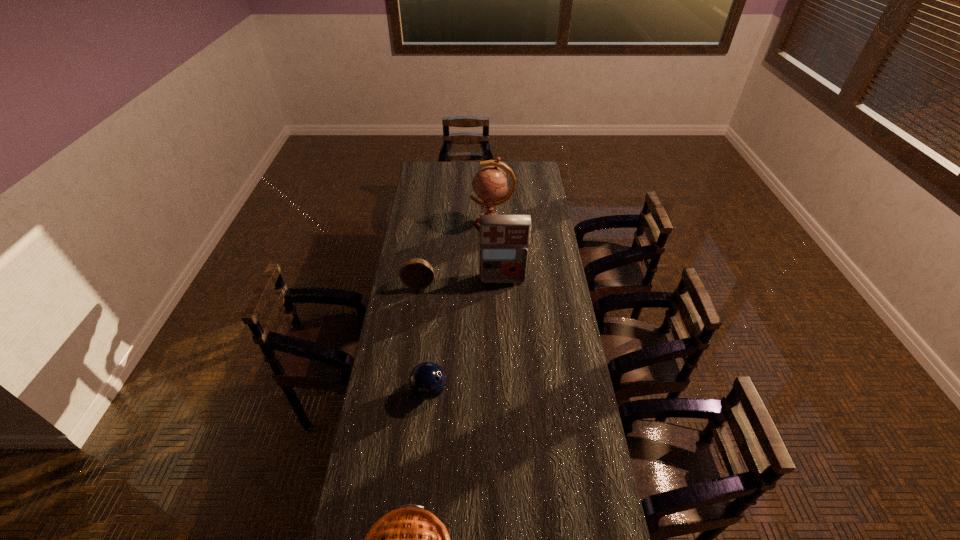
Image resolution: width=960 pixels, height=540 pixels. I want to click on vacant point located 0.190m on the surface of the fourth farthest object near the finger holes, so click(x=499, y=391).

The image size is (960, 540). Identify the location of bowl present at the left edge. (416, 273).

The image size is (960, 540). I want to click on bowling ball positioned at the left edge, so click(x=427, y=380).

In the image, there is a desktop. Where is `vacant space at the left edge`? This screenshot has width=960, height=540. vacant space at the left edge is located at coordinates (422, 225).

Identify the location of vacant region at the right edge of the desktop. This screenshot has width=960, height=540. (542, 224).

Locate an element on the screen. This screenshot has height=540, width=960. vacant area at the far right corner of the desktop is located at coordinates (533, 177).

The height and width of the screenshot is (540, 960). Find the location of `empty space between the bowling ball and the globe`. empty space between the bowling ball and the globe is located at coordinates (461, 308).

Where is `unoccupied area between the bowl and the globe`? This screenshot has width=960, height=540. unoccupied area between the bowl and the globe is located at coordinates (456, 254).

Locate an element on the screen. The width and height of the screenshot is (960, 540). vacant area that lies between the second shortest object and the second tallest object is located at coordinates (466, 335).

This screenshot has width=960, height=540. Find the location of `free spot between the first-aid kit and the bowling ball`. free spot between the first-aid kit and the bowling ball is located at coordinates (466, 335).